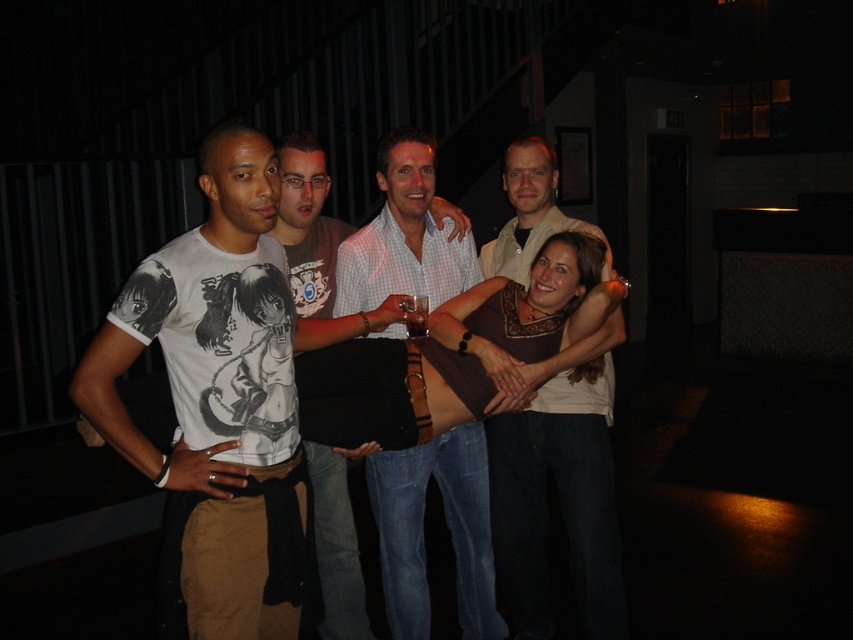
Measure the distance from light brown leather jacket at center to translucent glass beer at center.

light brown leather jacket at center and translucent glass beer at center are 25.85 inches apart.

Is point (608, 596) positioned behind point (405, 324)?

Yes, point (608, 596) is farther from viewer.

Who is more forward, (x=543, y=390) or (x=410, y=307)?

Point (x=410, y=307)

Identify the location of light brown leather jacket at center. This screenshot has width=853, height=640. (560, 488).

Who is shorter, light brown leather jacket at center or white checkered shirt at center?

white checkered shirt at center

Locate an element on the screen. light brown leather jacket at center is located at coordinates (560, 488).

Is point (582, 552) less distant than point (374, 273)?

No, it is not.

Identify the location of light brown leather jacket at center. (560, 488).

Is white checkered shirt at center closer to the viewer compared to translucent glass beer at center?

No, white checkered shirt at center is behind translucent glass beer at center.

Between white checkered shirt at center and translucent glass beer at center, which one appears on the right side from the viewer's perspective?

white checkered shirt at center

What do you see at coordinates (447, 525) in the screenshot?
I see `white checkered shirt at center` at bounding box center [447, 525].

The height and width of the screenshot is (640, 853). What are the coordinates of `white checkered shirt at center` in the screenshot? It's located at (447, 525).